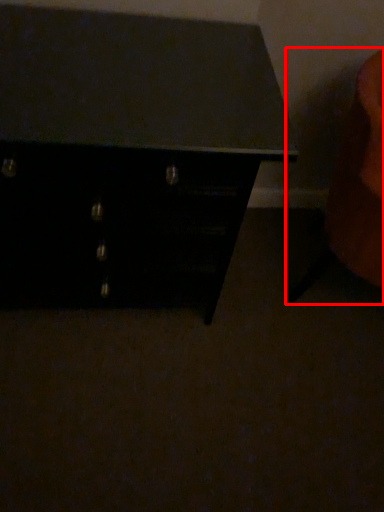
Question: From the image's perspective, where is swivel chair (annotated by the red box) located in relation to chest of drawers in the image?

Choices:
 (A) above
 (B) below

Answer: (B)